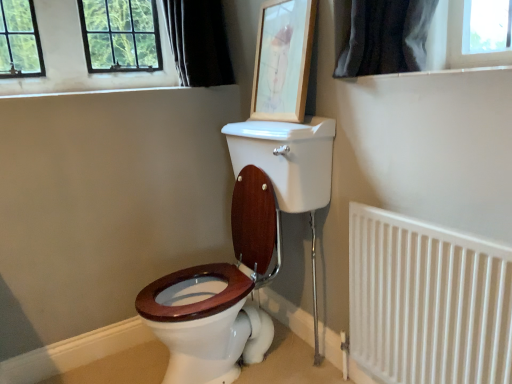
Question: Would you say black fabric curtain at upper left is to the left or to the right of wooden picture frame at upper center in the picture?

Choices:
 (A) left
 (B) right

Answer: (A)

Question: Is black fabric curtain at upper left in front of or behind wooden picture frame at upper center in the image?

Choices:
 (A) front
 (B) behind

Answer: (B)

Question: Which object is the closest to the white metal radiator at lower right?

Choices:
 (A) black fabric curtain at upper left
 (B) wooden picture frame at upper center

Answer: (B)

Question: Estimate the real-world distances between objects in this image. Which object is farther from the wooden picture frame at upper center?

Choices:
 (A) black fabric curtain at upper left
 (B) white metal radiator at lower right

Answer: (B)